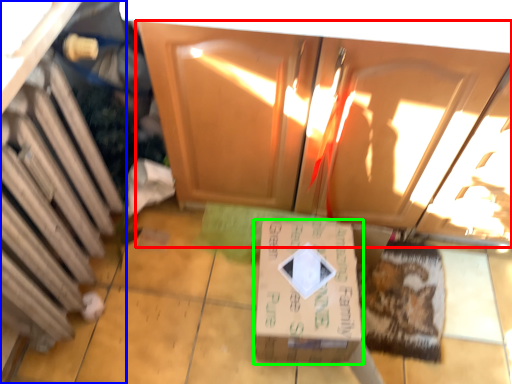
Question: Which is farther away from cabinetry (highlighted by a red box)? cabinetry (highlighted by a blue box) or box (highlighted by a green box)?

Choices:
 (A) cabinetry
 (B) box

Answer: (A)